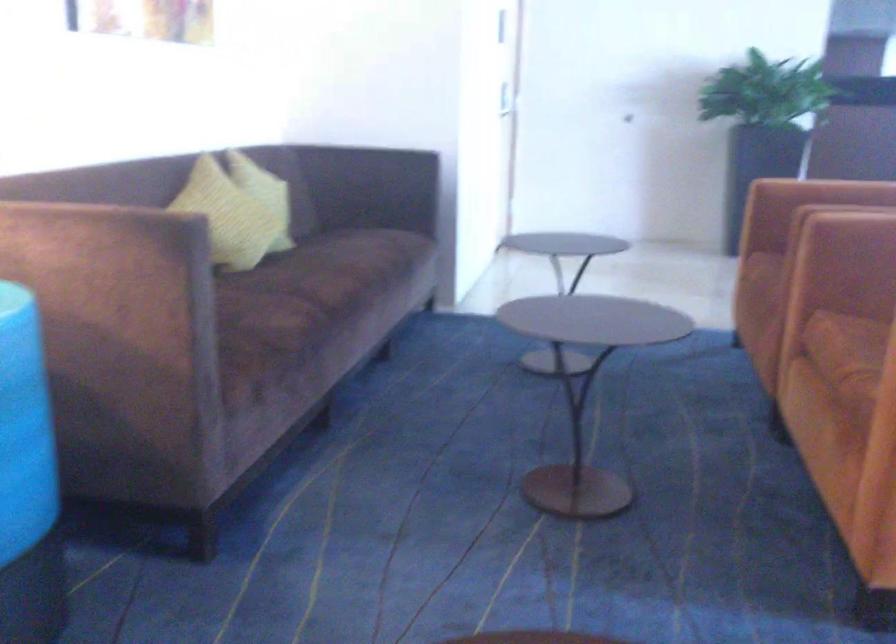
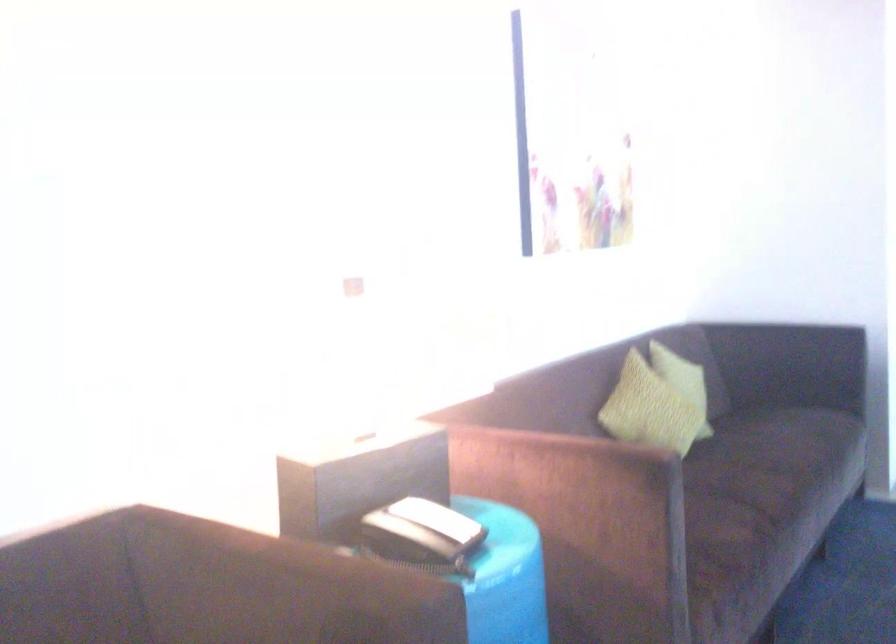
The point at (250, 204) is marked in the first image. Where is the corresponding point in the second image?

(683, 381)